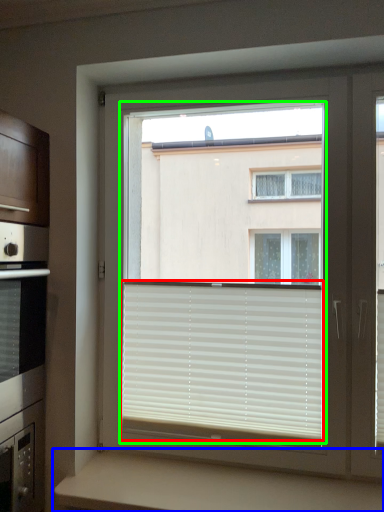
Question: Estimate the real-world distances between objects in this image. Which object is closer to window blind (highlighted by a red box), counter (highlighted by a blue box) or bay window (highlighted by a green box)?

Choices:
 (A) counter
 (B) bay window

Answer: (A)